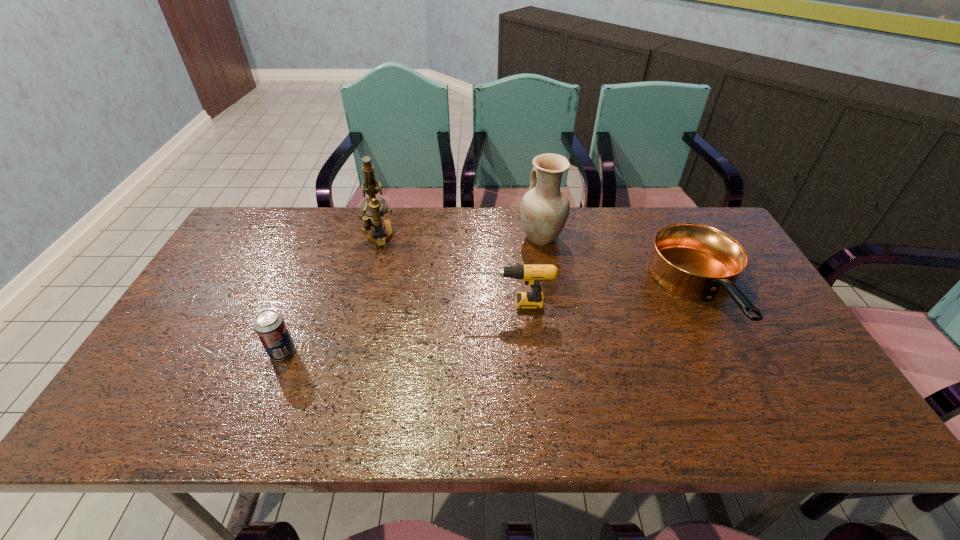
This screenshot has height=540, width=960. Identify the location of blank space located on the handle side of the drill. (395, 303).

You are a GUI agent. You are given a task and a screenshot of the screen. Output one action in this format:
    pyautogui.click(x=<x>, y=<y>)
    Task: Click on the vacant area situated on the back of the leftmost object
    The height and width of the screenshot is (540, 960).
    Given the screenshot: What is the action you would take?
    pyautogui.click(x=295, y=321)

This screenshot has height=540, width=960. In order to click on microscope situated at the far edge in this screenshot , I will do `click(373, 208)`.

This screenshot has width=960, height=540. Identify the location of pottery present at the far edge. (544, 210).

The image size is (960, 540). What are the coordinates of `frying pan situated at the far edge` in the screenshot? It's located at (694, 261).

In order to click on object located at the right edge in this screenshot , I will do 694,261.

Locate an element on the screen. This screenshot has height=540, width=960. object at the far right corner is located at coordinates (694, 261).

In the image, there is a desktop. Where is `vacant space at the far edge`? vacant space at the far edge is located at coordinates (507, 213).

The width and height of the screenshot is (960, 540). What are the coordinates of `free region at the near edge of the desktop` in the screenshot? It's located at (201, 407).

Where is `vacant position at the right edge of the desktop`? The height and width of the screenshot is (540, 960). vacant position at the right edge of the desktop is located at coordinates (766, 368).